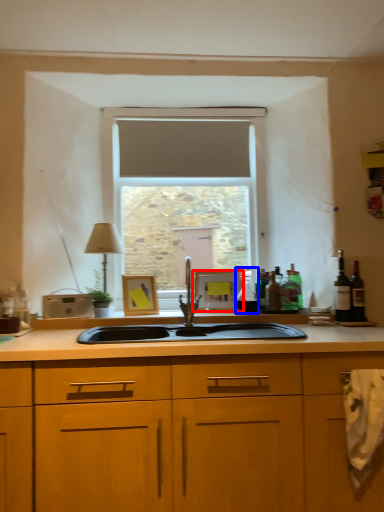
Question: Which object is further to the camera taking this photo, picture frame (highlighted by a red box) or bottle (highlighted by a blue box)?

Choices:
 (A) picture frame
 (B) bottle

Answer: (A)